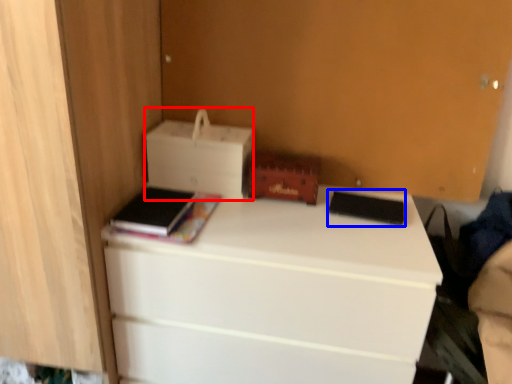
Question: Which object appears closest to the camera in this image, printer (highlighted by a red box) or paperback book (highlighted by a blue box)?

Choices:
 (A) printer
 (B) paperback book

Answer: (B)